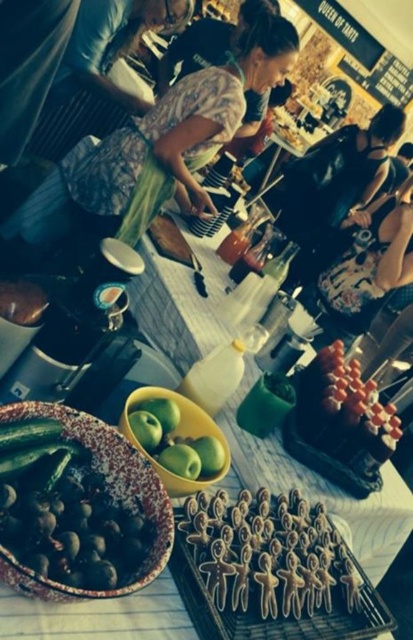
You are a chef trying to place a new set of utensils on the table. The camouflage fabric apron at center and brown sugar cookies at center are already occupying space. Which object should you move to make room if you want to keep the other in its current position?

The camouflage fabric apron at center is wider than the brown sugar cookies at center, so you should move the camouflage fabric apron at center to make more space while keeping the brown sugar cookies at center in place.

You are a customer at the food stall and want to pick up both items located at point [251,61] and point [242,602]. Which item should you reach for first to minimize bending down?

You should reach for point 0.091, 0.610 first because it is closer to you than point [242,602], requiring less bending.